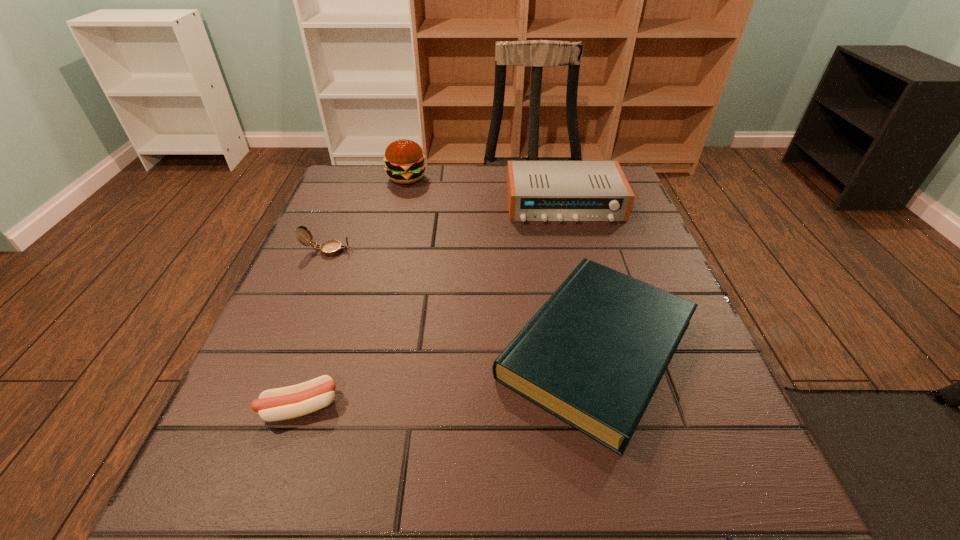
Where is `unoccupied position between the sausage and the radio receiver`? This screenshot has width=960, height=540. unoccupied position between the sausage and the radio receiver is located at coordinates (432, 305).

At what (x,y) coordinates should I click in order to perform the action: click on unoccupied area between the hamburger and the book. Please return your answer as a coordinate pair (x, y). The image size is (960, 540). Looking at the image, I should click on (502, 264).

What are the coordinates of `free space between the tallest object and the third farthest object` in the screenshot? It's located at (367, 214).

Locate an element on the screen. Image resolution: width=960 pixels, height=540 pixels. free space between the compass and the hamburger is located at coordinates (367, 214).

I want to click on object that is the second closest to the sausage, so click(330, 248).

Select which object appears as the fourth closest to the sausage. Please provide its 2D coordinates. Your answer should be formatted as a tuple, i.e. [(x, y)], where the tuple contains the x and y coordinates of a point satisfying the conditions above.

[(404, 159)]

Where is `vacant point that satisfies the following two spatial constraints: 1. on the front side of the book; 2. on the right side of the hamburger`? The height and width of the screenshot is (540, 960). vacant point that satisfies the following two spatial constraints: 1. on the front side of the book; 2. on the right side of the hamburger is located at coordinates (365, 350).

Where is `vacant point that satisfies the following two spatial constraints: 1. on the front side of the book; 2. on the right side of the hamburger`? vacant point that satisfies the following two spatial constraints: 1. on the front side of the book; 2. on the right side of the hamburger is located at coordinates (365, 350).

This screenshot has height=540, width=960. What are the coordinates of `vacant space that satisfies the following two spatial constraints: 1. on the back side of the second shortest object; 2. on the face of the compass` in the screenshot? It's located at (572, 251).

Where is `vacant area that satisfies the following two spatial constraints: 1. on the front side of the hamburger; 2. on the face of the third nearest object`? This screenshot has height=540, width=960. vacant area that satisfies the following two spatial constraints: 1. on the front side of the hamburger; 2. on the face of the third nearest object is located at coordinates (389, 251).